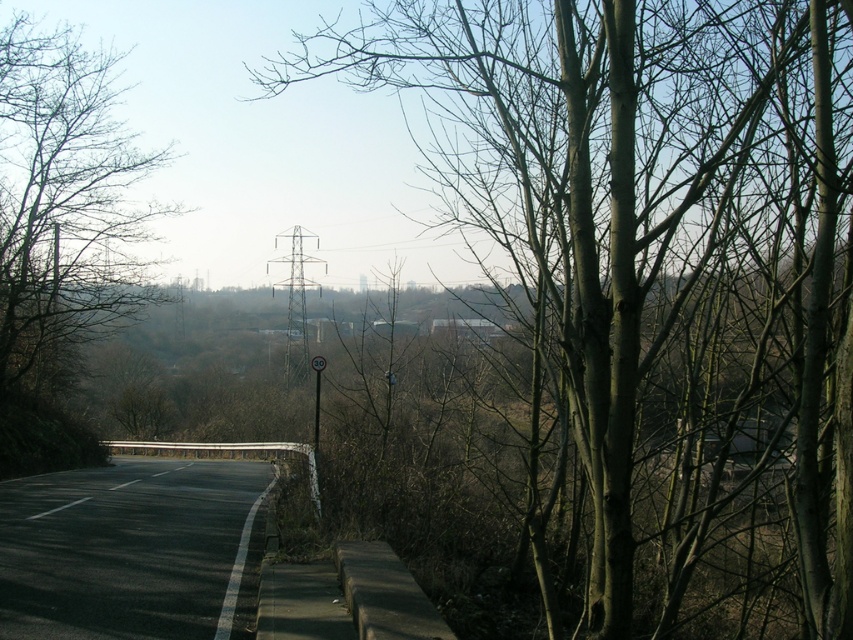
Can you confirm if brown rough tree at center is positioned to the right of black asphalt highway at lower left?

Indeed, brown rough tree at center is positioned on the right side of black asphalt highway at lower left.

What do you see at coordinates (653, 280) in the screenshot? Image resolution: width=853 pixels, height=640 pixels. I see `brown rough tree at center` at bounding box center [653, 280].

Image resolution: width=853 pixels, height=640 pixels. What are the coordinates of `brown rough tree at center` in the screenshot? It's located at (653, 280).

From the picture: Between bare branches at left and black asphalt highway at lower left, which one is positioned lower?

black asphalt highway at lower left is below.

Find the location of a particular element. This screenshot has width=853, height=640. bare branches at left is located at coordinates (61, 236).

Which is in front, point (138, 154) or point (148, 602)?

Point (148, 602)

Find the location of a particular element. Image resolution: width=853 pixels, height=640 pixels. bare branches at left is located at coordinates (61, 236).

Which of these two, brown rough tree at center or bare branches at left, stands shorter?

Standing shorter between the two is bare branches at left.

Is brown rough tree at center closer to camera compared to bare branches at left?

Yes, it is in front of bare branches at left.

I want to click on brown rough tree at center, so click(x=653, y=280).